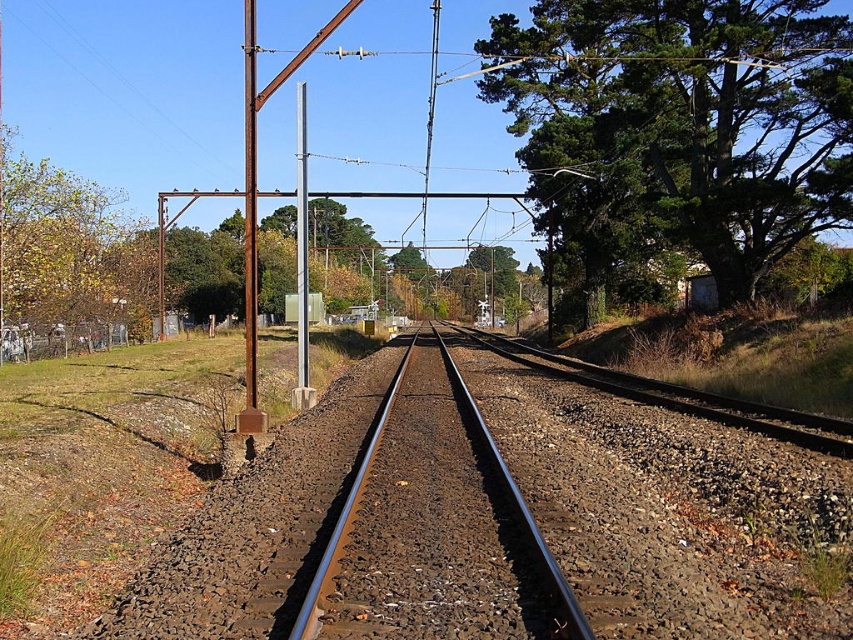
Question: Considering the real-world distances, which object is farthest from the green leafy tree at upper right?

Choices:
 (A) rusty metal pole at left
 (B) smooth steel tracks at center
 (C) metallic pole at center

Answer: (A)

Question: Can you confirm if smooth steel tracks at center is positioned to the left of metallic pole at center?

Choices:
 (A) yes
 (B) no

Answer: (B)

Question: Considering the real-world distances, which object is farthest from the green leafy tree at upper right?

Choices:
 (A) metallic pole at center
 (B) rusty metal pole at left

Answer: (B)

Question: Does smooth steel tracks at center have a smaller size compared to metallic pole at center?

Choices:
 (A) no
 (B) yes

Answer: (B)

Question: Among these objects, which one is nearest to the camera?

Choices:
 (A) rusty metal pole at left
 (B) green leafy tree at upper right
 (C) metallic pole at center
 (D) smooth steel tracks at center

Answer: (D)

Question: Is green leafy tree at upper right to the left of metallic pole at center from the viewer's perspective?

Choices:
 (A) yes
 (B) no

Answer: (B)